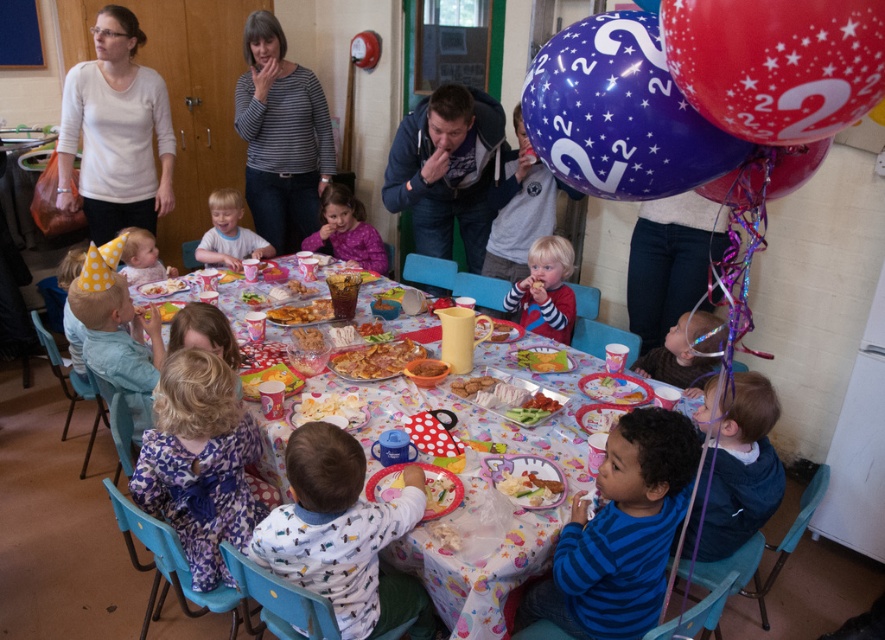
Question: Which point is farther to the camera?

Choices:
 (A) pyautogui.click(x=510, y=296)
 (B) pyautogui.click(x=310, y=326)

Answer: (A)

Question: Which point appears closest to the camera in this image?

Choices:
 (A) (730, 81)
 (B) (212, 248)

Answer: (A)

Question: Is red glossy balloon at upper right in front of golden brown cookie at center?

Choices:
 (A) no
 (B) yes

Answer: (B)

Question: Which of the following is the closest to the observer?

Choices:
 (A) purple fleece jacket at center
 (B) matte yellow party hat at lower left
 (C) white matte shirt at upper left
 (D) white glossy pasta at center

Answer: (D)

Question: Can you confirm if striped shirt at lower center is positioned below brown crumbly cake at center?

Choices:
 (A) yes
 (B) no

Answer: (B)

Question: Is red glossy balloon at upper right thinner than blue denim jacket at center?

Choices:
 (A) no
 (B) yes

Answer: (B)